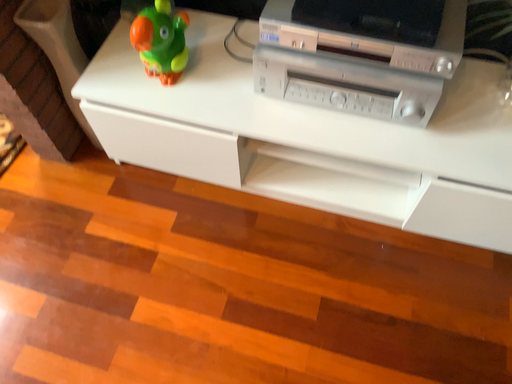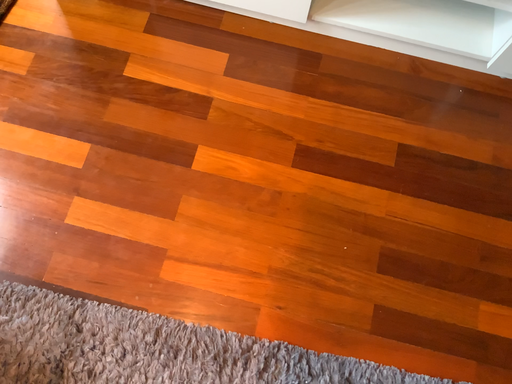
Question: Which way did the camera rotate in the video?

Choices:
 (A) rotated upward
 (B) rotated downward

Answer: (B)